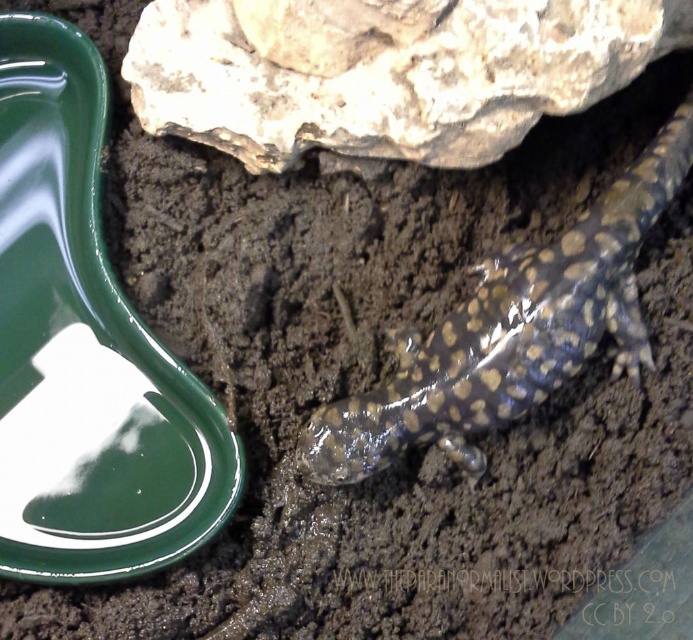
Consider the image. You are a biologist observing the terrarium. You notice the rough textured rock at upper center and the shiny brown spotted lizard at lower right. Which object is positioned to the left of the other?

The rough textured rock at upper center is to the left of the shiny brown spotted lizard at lower right.

What is located at the point with coordinates [385,72] in the terrarium?

A rough textured rock at upper center is located at the point with coordinates [385,72] in the terrarium.

Consider the image. You are a small insect in the terrarium. You want to move from the rough textured rock at upper center to the shiny brown spotted lizard at lower right. Can you crawl under the rock to reach the lizard?

The rough textured rock at upper center is in front of the shiny brown spotted lizard at lower right, so yes, you can crawl under the rock to reach the lizard since it is positioned in front of the lizard.